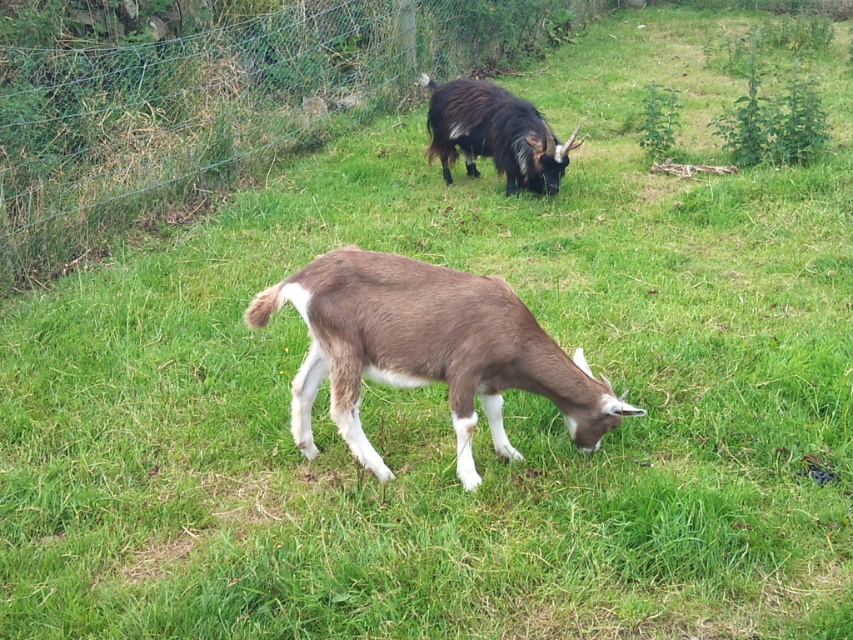
Question: Which point appears farthest from the camera in this image?

Choices:
 (A) (453, 424)
 (B) (399, 38)
 (C) (448, 102)

Answer: (B)

Question: Does metal wire fence at upper center appear over brown furry goat at center?

Choices:
 (A) no
 (B) yes

Answer: (B)

Question: Can you confirm if metal wire fence at upper center is bigger than dark brown woolen goat at upper center?

Choices:
 (A) no
 (B) yes

Answer: (A)

Question: Which point is closer to the camera?

Choices:
 (A) (322, 268)
 (B) (120, 220)
 (C) (532, 141)

Answer: (A)

Question: Based on their relative distances, which object is farther from the dark brown woolen goat at upper center?

Choices:
 (A) metal wire fence at upper center
 (B) brown furry goat at center

Answer: (B)

Question: Does metal wire fence at upper center come behind dark brown woolen goat at upper center?

Choices:
 (A) no
 (B) yes

Answer: (A)